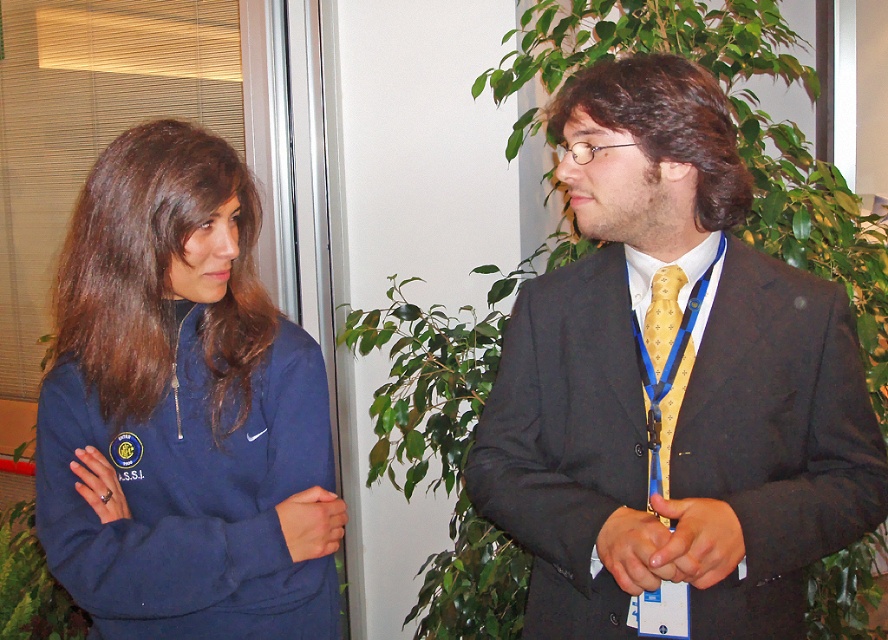
You are standing in the room and want to take a photo of the point at coordinates (688, 243). The camera you have can only focus on objects within 3.5 feet. Will you be able to capture a clear photo of the point?

The point at coordinates (688, 243) is 4.01 feet away from the camera, which is beyond the camera focus range of 3.5 feet. Therefore, the photo will not be clear.